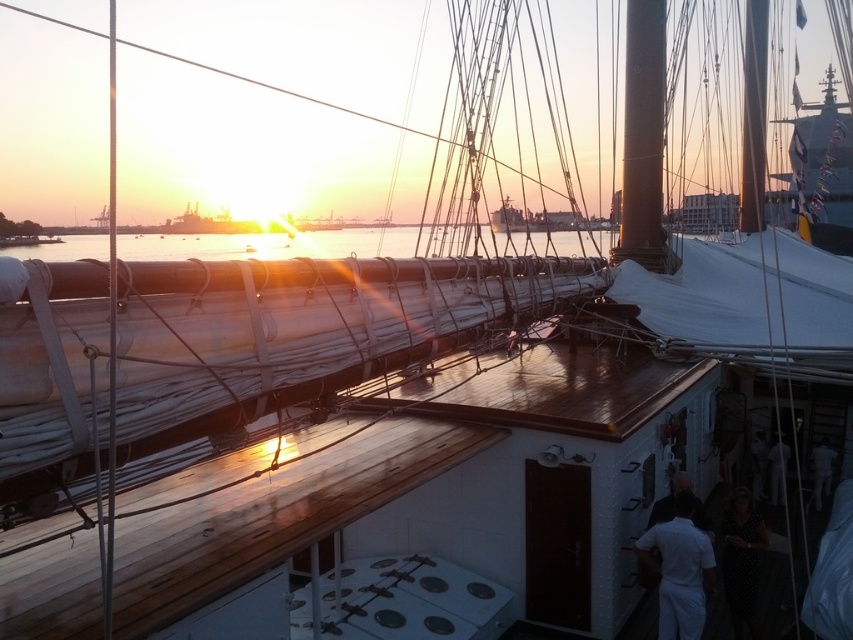
You are standing on the deck of the ship and want to locate the smooth brown wood mast at upper center. According to the coordinates provided, where should you look?

The smooth brown wood mast at upper center is located at coordinates point (643, 138).

You are standing on the deck of the ship and want to take a photo of the shiny metallic water at center and the smooth brown wood mast at upper center. Which object should you focus on first if you want both to be in sharp focus?

The shiny metallic water at center is closer to the viewer than the smooth brown wood mast at upper center. To have both in sharp focus, focus on the smooth brown wood mast at upper center since it is farther away, ensuring the closer object will also be in focus.

You are a sailor on the deck of the ship and need to secure a rope. You have two options for tying it to either the shiny metallic water at center or the metallic polished mast at upper center. Which object is shorter and therefore more accessible for tying the rope?

The shiny metallic water at center is not as tall as the metallic polished mast at upper center, so the shiny metallic water at center is shorter and more accessible for tying the rope.